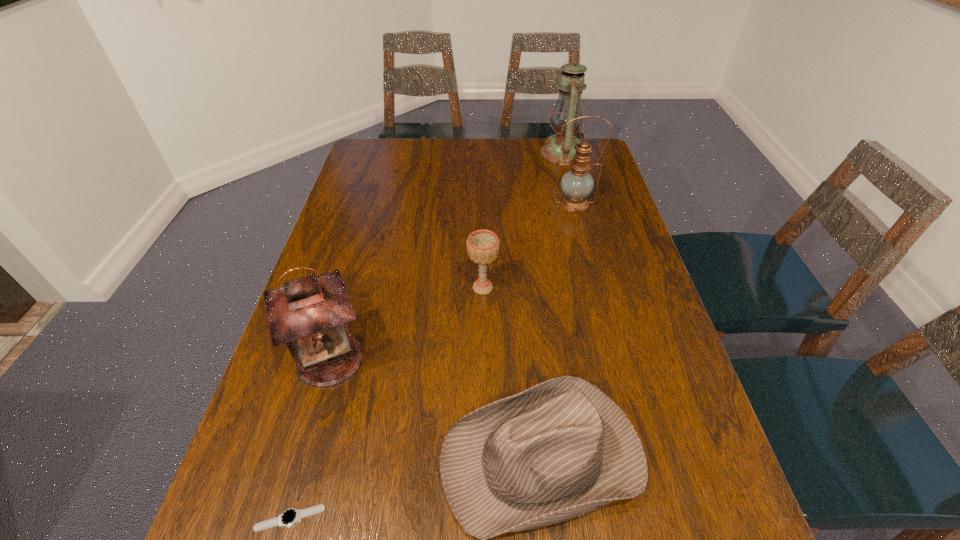
At what (x,y) coordinates should I click in order to perform the action: click on vacant space that satisfies the following two spatial constraints: 1. on the back side of the fourth nearest object; 2. on the left side of the tallest oil lamp. Please return your answer as a coordinate pair (x, y). The height and width of the screenshot is (540, 960). Looking at the image, I should click on (482, 153).